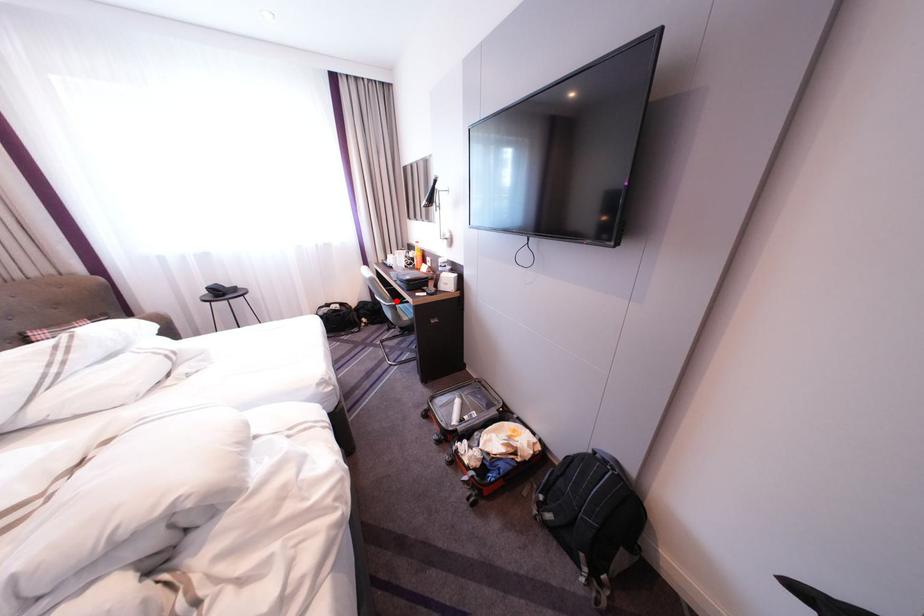
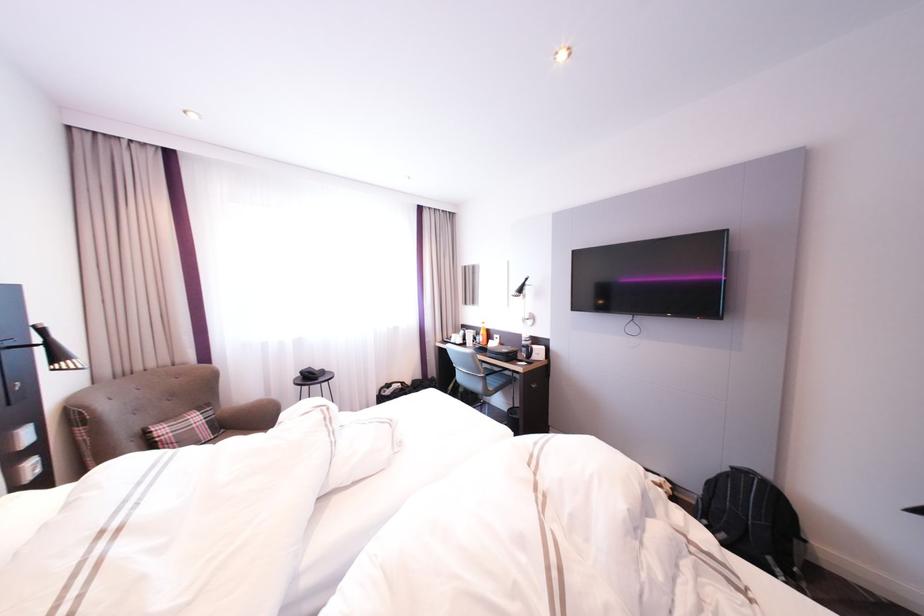
Question: A red point is marked in image1. In image2, is the corresponding 3D point closer to the camera or farther? Reply with the corresponding letter.

Choices:
 (A) The corresponding 3D point is closer.
 (B) The corresponding 3D point is farther.

Answer: (A)